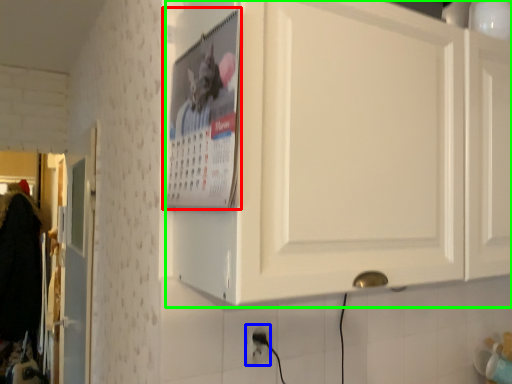
Question: Based on their relative distances, which object is nearer to poster page (highlighted by a red box)? Choose from electric outlet (highlighted by a blue box) and cabinetry (highlighted by a green box).

Choices:
 (A) electric outlet
 (B) cabinetry

Answer: (B)